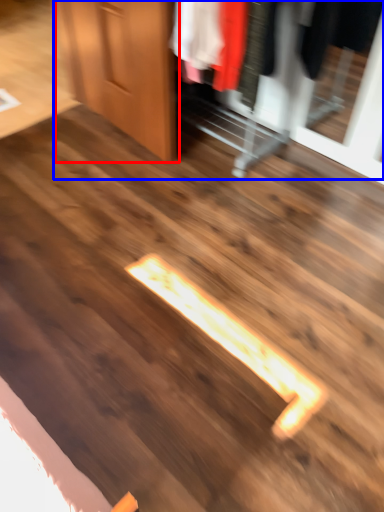
Question: Which of the following is the closest to the observer, door (highlighted by a red box) or dresser (highlighted by a blue box)?

Choices:
 (A) door
 (B) dresser

Answer: (B)